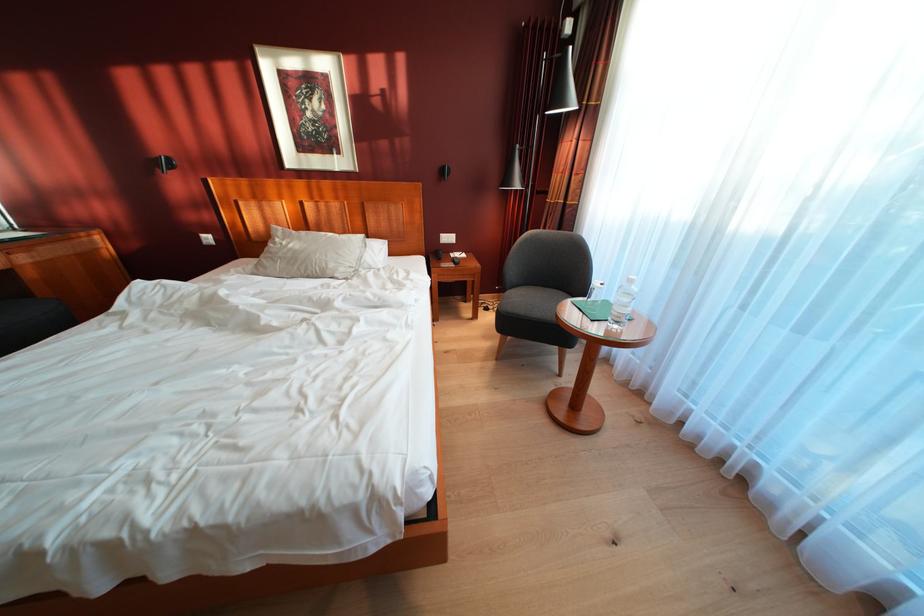
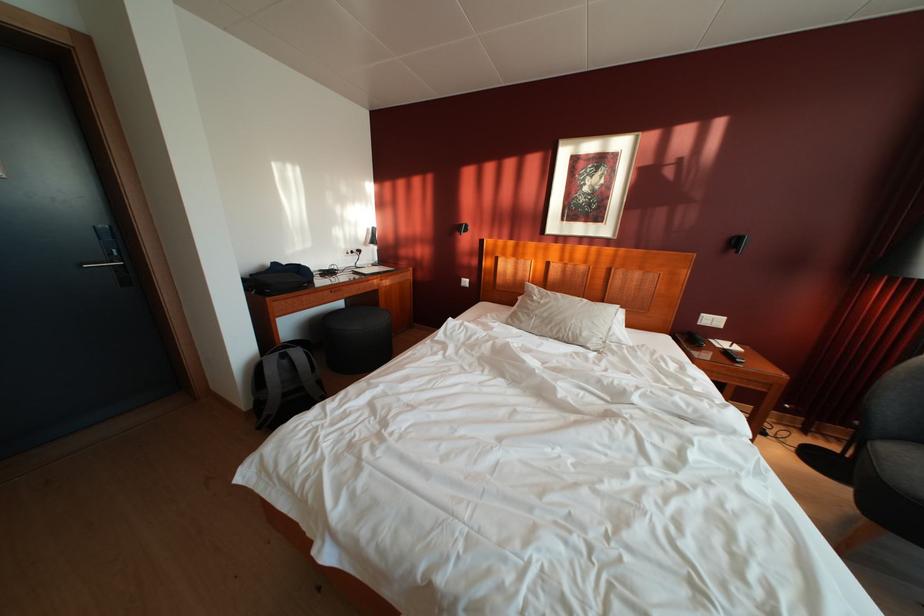
Question: The camera is either moving clockwise (left) or counter-clockwise (right) around the object. The first image is from the beginning of the video and the second image is from the end. Is the camera moving left or right when shooting the video?

Choices:
 (A) Left
 (B) Right

Answer: (B)